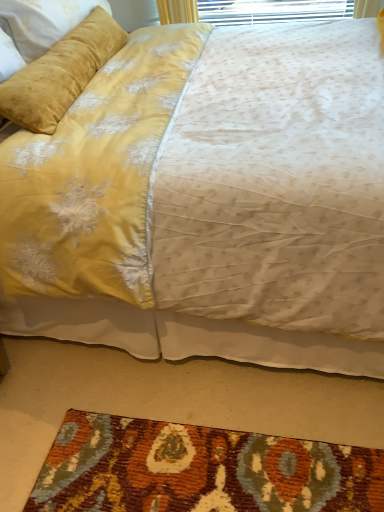
Question: Does velvet yellow bed at upper center turn towards velvet yellow pillow at upper left?

Choices:
 (A) no
 (B) yes

Answer: (A)

Question: From a real-world perspective, is velvet yellow bed at upper center positioned over velvet yellow pillow at upper left based on gravity?

Choices:
 (A) yes
 (B) no

Answer: (B)

Question: Is velvet yellow bed at upper center smaller than velvet yellow pillow at upper left?

Choices:
 (A) no
 (B) yes

Answer: (A)

Question: From the image's perspective, is velvet yellow bed at upper center beneath velvet yellow pillow at upper left?

Choices:
 (A) yes
 (B) no

Answer: (A)

Question: Can you confirm if velvet yellow bed at upper center is positioned to the right of velvet yellow pillow at upper left?

Choices:
 (A) no
 (B) yes

Answer: (B)

Question: Is velvet yellow bed at upper center bigger than velvet yellow pillow at upper left?

Choices:
 (A) no
 (B) yes

Answer: (B)

Question: Does textured wool mat at lower center contain velvet yellow bed at upper center?

Choices:
 (A) yes
 (B) no

Answer: (B)

Question: Are textured wool mat at lower center and velvet yellow bed at upper center located far from each other?

Choices:
 (A) no
 (B) yes

Answer: (A)

Question: Is textured wool mat at lower center facing away from velvet yellow bed at upper center?

Choices:
 (A) yes
 (B) no

Answer: (B)

Question: Does textured wool mat at lower center have a lesser height compared to velvet yellow bed at upper center?

Choices:
 (A) no
 (B) yes

Answer: (B)

Question: Does textured wool mat at lower center appear on the right side of velvet yellow bed at upper center?

Choices:
 (A) yes
 (B) no

Answer: (B)

Question: Does textured wool mat at lower center have a smaller size compared to velvet yellow bed at upper center?

Choices:
 (A) no
 (B) yes

Answer: (B)

Question: Does velvet yellow pillow at upper left have a lesser width compared to velvet yellow bed at upper center?

Choices:
 (A) no
 (B) yes

Answer: (B)